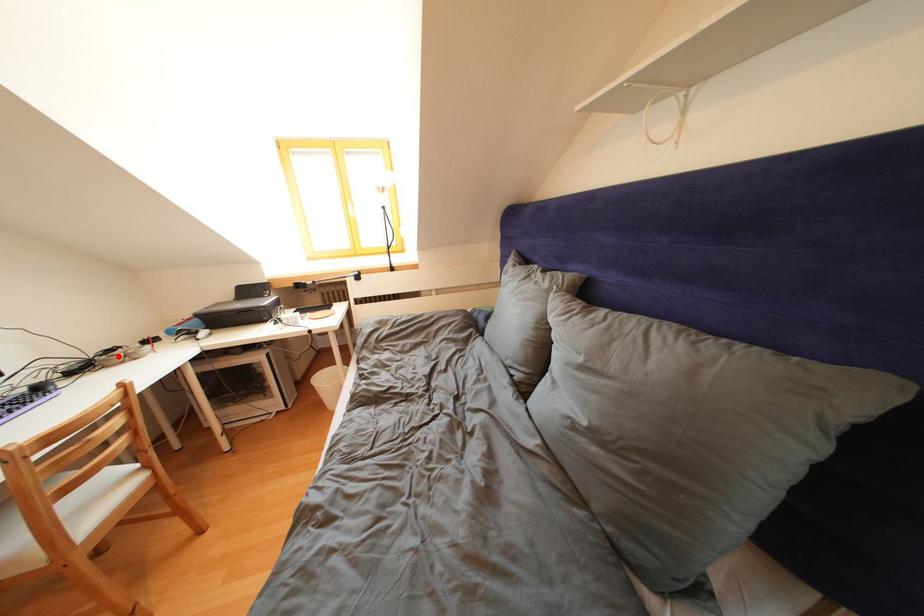
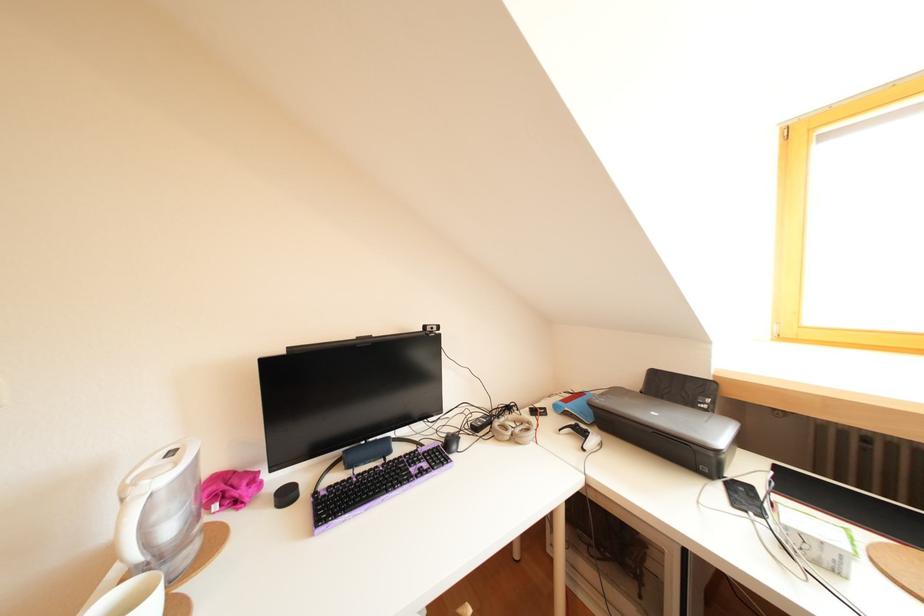
Locate, in the second image, the point that corresponds to the highlighted location in the first image.

(516, 413)